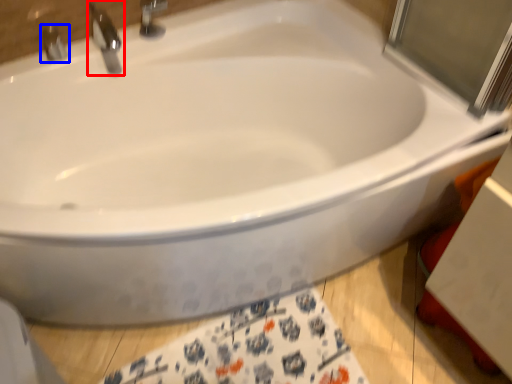
Question: Which object is further to the camera taking this photo, tap (highlighted by a red box) or tap (highlighted by a blue box)?

Choices:
 (A) tap
 (B) tap

Answer: (B)